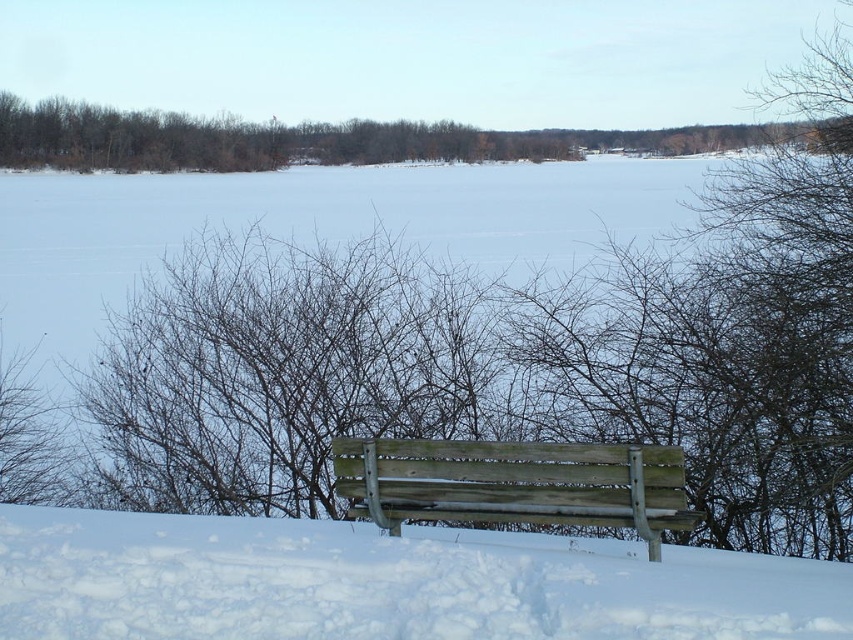
You are a snowplow operator who needs to clear the snow from the area around the weathered wood bench at center. Based on the scene, where is the white fluffy snow at lower center in relation to the bench?

The white fluffy snow at lower center is located below the weathered wood bench at center, so you should focus clearing the snow from the area below the bench.